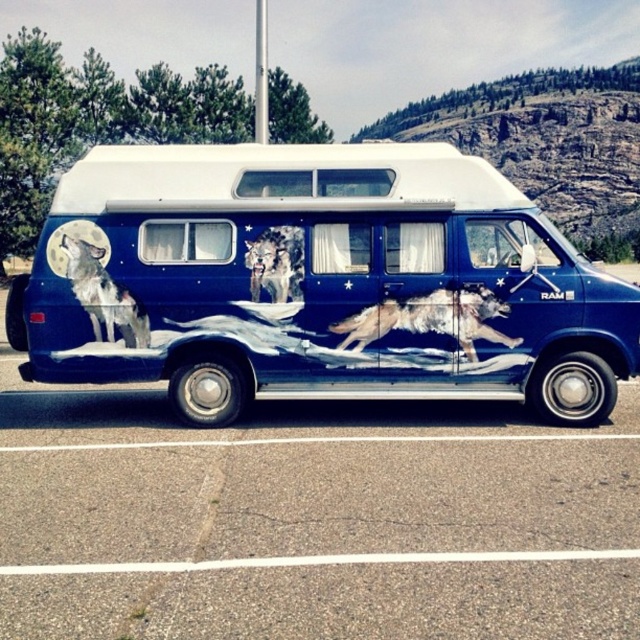
Question: Is shiny silver wolf at center to the left of gray fur wolf at left from the viewer's perspective?

Choices:
 (A) yes
 (B) no

Answer: (B)

Question: Based on their relative distances, which object is farther from the blue matte van at center?

Choices:
 (A) gray fur wolf at left
 (B) shiny metallic wolf at center
 (C) blue glossy van at center

Answer: (C)

Question: Observing the image, what is the correct spatial positioning of blue matte van at center in reference to shiny metallic wolf at center?

Choices:
 (A) below
 (B) above

Answer: (B)

Question: Which of the following is the closest to the observer?

Choices:
 (A) (426, 332)
 (B) (564, 481)
 (C) (230, 266)
 (D) (272, 275)

Answer: (B)

Question: Which point appears farthest from the camera in this image?

Choices:
 (A) (508, 564)
 (B) (358, 324)
 (C) (266, 236)
 (D) (545, 323)

Answer: (C)

Question: Can you confirm if gray fur wolf at left is positioned to the right of shiny metallic wolf at center?

Choices:
 (A) yes
 (B) no

Answer: (B)